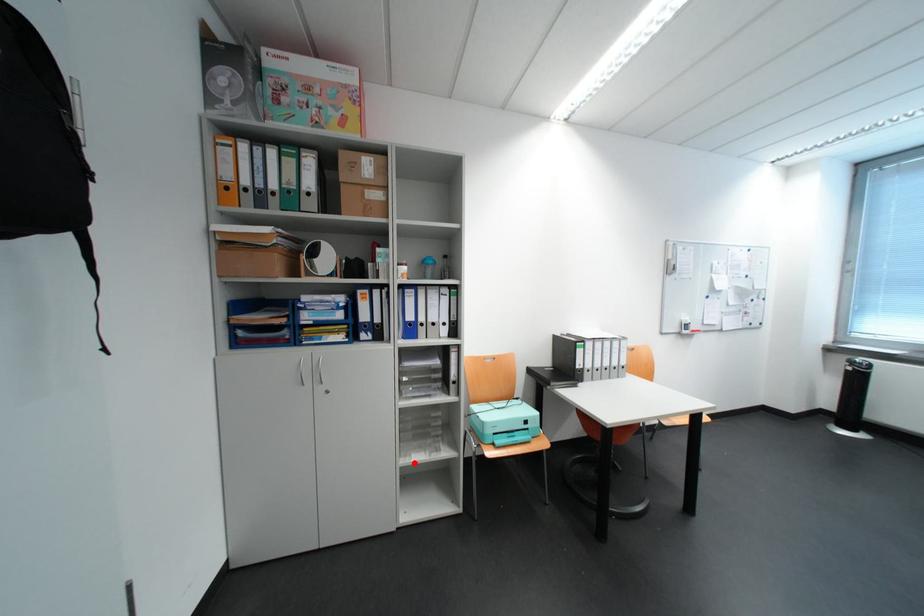
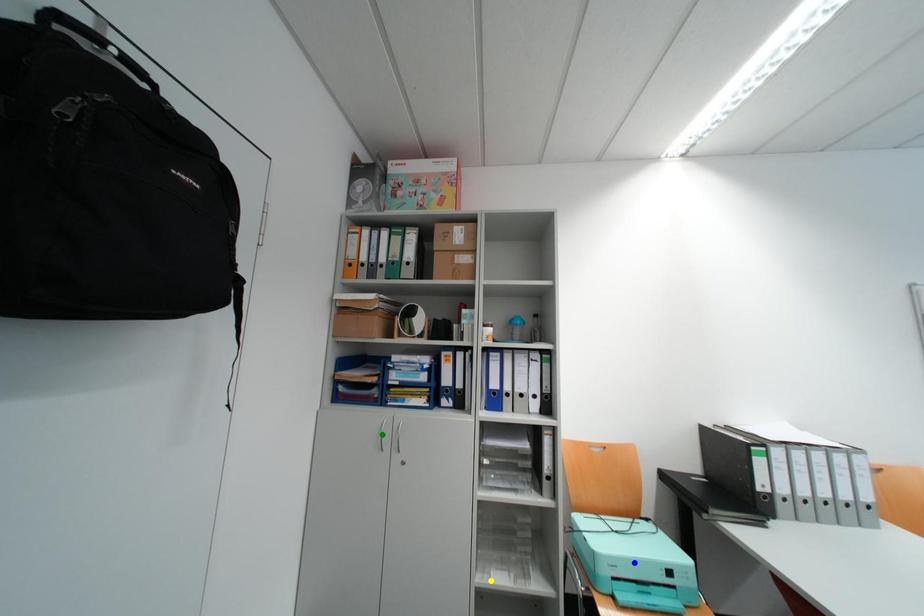
Question: I am providing you with two images of the same scene from different viewpoints. A red point is marked on the first image. You are given multiple points on the second image. Which mark in image 2 goes with the point in image 1?

Choices:
 (A) green point
 (B) yellow point
 (C) blue point

Answer: (B)